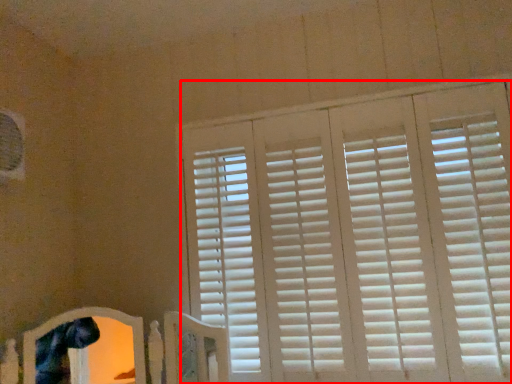
Question: In this image, where is window blind (annotated by the red box) located relative to bed frame?

Choices:
 (A) left
 (B) right

Answer: (B)